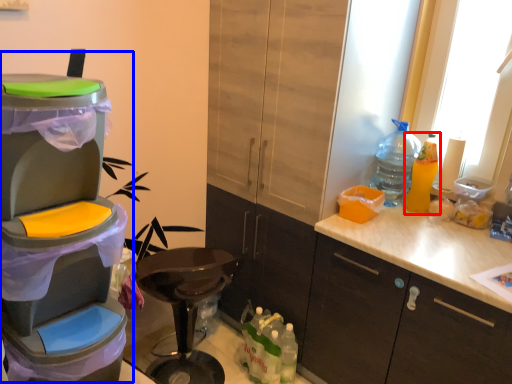
Question: Which object appears closest to the camera in this image, bottle (highlighted by a red box) or appliance (highlighted by a blue box)?

Choices:
 (A) bottle
 (B) appliance

Answer: (B)